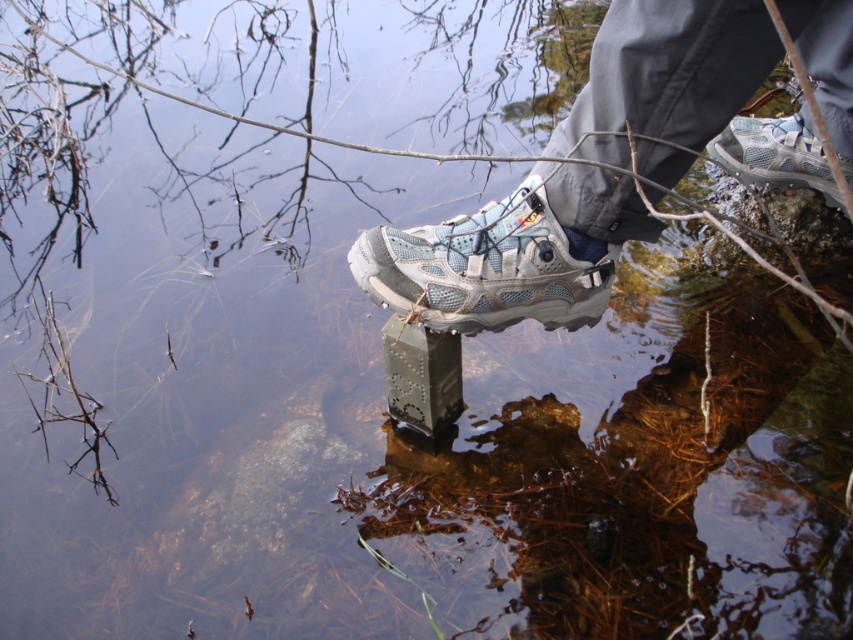
Question: Can you confirm if matte gray shoe at center is positioned below matte gray mesh shoe at center?

Choices:
 (A) yes
 (B) no

Answer: (B)

Question: Is matte gray mesh shoe at center thinner than white mesh shoe at center?

Choices:
 (A) no
 (B) yes

Answer: (A)

Question: Which object appears closest to the camera in this image?

Choices:
 (A) white mesh shoe at center
 (B) matte gray mesh shoe at center

Answer: (B)

Question: Which of the following is the farthest from the observer?

Choices:
 (A) (367, 234)
 (B) (584, 264)

Answer: (B)

Question: Which point appears farthest from the camera in this image?

Choices:
 (A) (576, 234)
 (B) (732, 157)

Answer: (B)

Question: Can you confirm if matte gray shoe at center is positioned below matte gray mesh shoe at center?

Choices:
 (A) yes
 (B) no

Answer: (B)